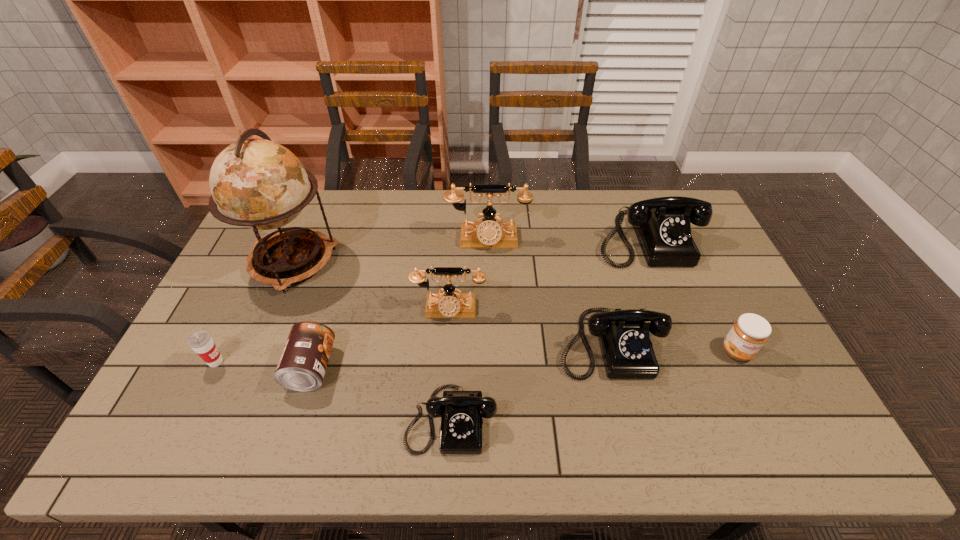
What are the coordinates of `unoccupied position between the nearest telephone and the tallest telephone` in the screenshot? It's located at (469, 329).

Image resolution: width=960 pixels, height=540 pixels. What are the coordinates of `object that is the eighth closest to the orange jam` in the screenshot? It's located at (201, 342).

This screenshot has width=960, height=540. In order to click on object that ranks as the eighth closest to the shortest telephone in this screenshot , I will do [749, 333].

Where is `telephone that is the third closest to the farthest black telephone`? Image resolution: width=960 pixels, height=540 pixels. telephone that is the third closest to the farthest black telephone is located at coordinates (449, 304).

Select which telephone appears as the third closest to the can. Please provide its 2D coordinates. Your answer should be formatted as a tuple, i.e. [(x, y)], where the tuple contains the x and y coordinates of a point satisfying the conditions above.

[(488, 233)]

Select which black telephone is the second closest to the smallest black telephone. Please provide its 2D coordinates. Your answer should be formatted as a tuple, i.e. [(x, y)], where the tuple contains the x and y coordinates of a point satisfying the conditions above.

[(662, 225)]

At what (x,y) coordinates should I click in order to perform the action: click on black telephone that is the closest to the second tallest object. Please return your answer as a coordinate pair (x, y). Image resolution: width=960 pixels, height=540 pixels. Looking at the image, I should click on pos(662,225).

Locate an element on the screen. Image resolution: width=960 pixels, height=540 pixels. free spot that satisfies the following two spatial constraints: 1. at the center of the tallest object; 2. on the side of the red cup with the logo is located at coordinates (251, 362).

Identify the location of vacant position in the image that satisfies the following two spatial constraints: 1. on the dial of the bigger beige telephone; 2. on the front label of the can. The width and height of the screenshot is (960, 540). click(490, 368).

Where is `free spot that satisfies the following two spatial constraints: 1. on the dial of the second tallest object; 2. on the side of the red cup with the logo`? free spot that satisfies the following two spatial constraints: 1. on the dial of the second tallest object; 2. on the side of the red cup with the logo is located at coordinates (490, 362).